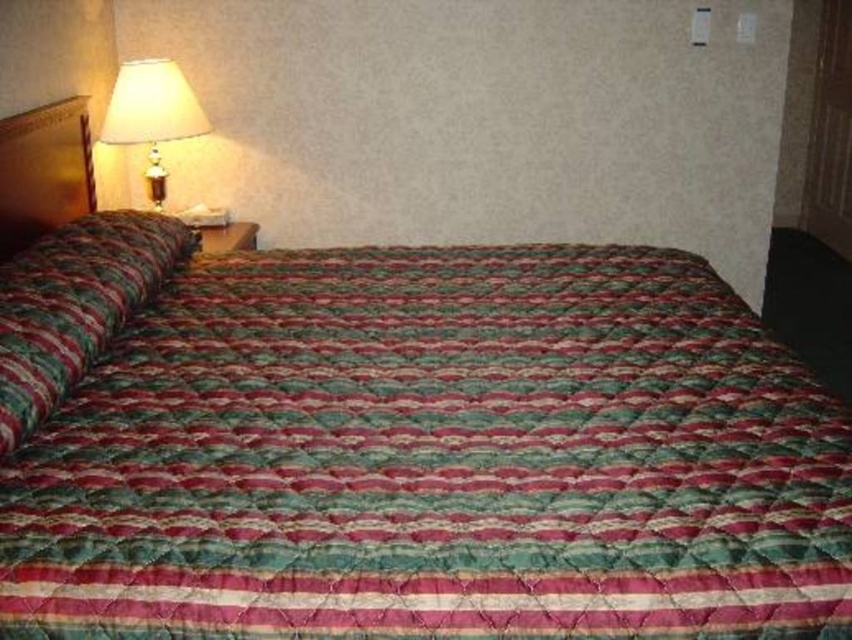
Question: Which of the following is the farthest from the observer?

Choices:
 (A) quilted fabric blanket at center
 (B) matte cream lampshade at upper left
 (C) textured cotton pillow at left

Answer: (B)

Question: Is quilted fabric blanket at center further to the viewer compared to matte cream lampshade at upper left?

Choices:
 (A) no
 (B) yes

Answer: (A)

Question: Which of the following is the closest to the observer?

Choices:
 (A) textured cotton pillow at left
 (B) quilted fabric blanket at center
 (C) matte cream lampshade at upper left

Answer: (B)

Question: Which point appears farthest from the camera in this image?

Choices:
 (A) (x=190, y=86)
 (B) (x=78, y=342)
 (C) (x=787, y=632)

Answer: (A)

Question: Where is quilted fabric blanket at center located in relation to matte cream lampshade at upper left in the image?

Choices:
 (A) right
 (B) left

Answer: (A)

Question: Does quilted fabric blanket at center have a larger size compared to textured cotton pillow at left?

Choices:
 (A) yes
 (B) no

Answer: (A)